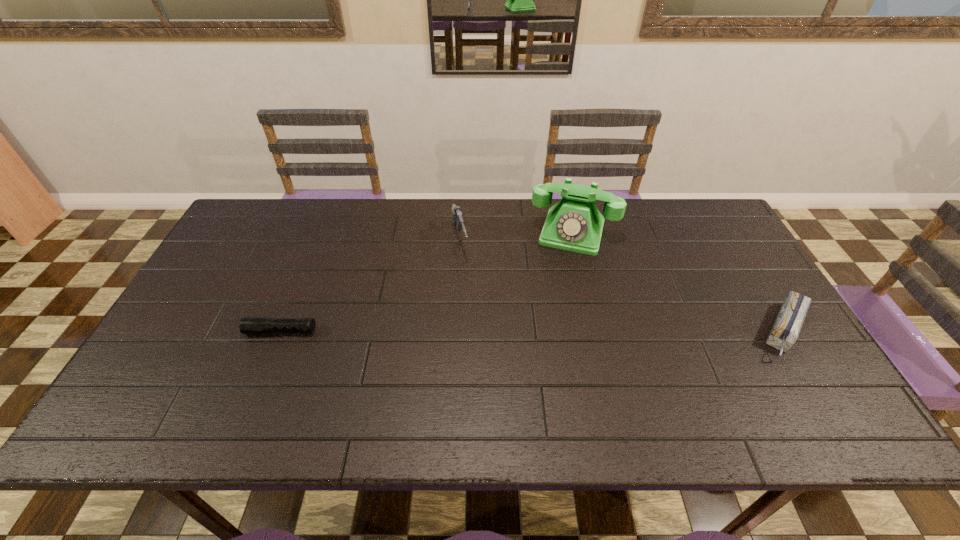
At what (x,y) coordinates should I click in order to perform the action: click on vacant space on the desktop that is between the shortest object and the rightmost object and is positioned at the barrel of the second object from left to right. Please return your answer as a coordinate pair (x, y). Looking at the image, I should click on (488, 331).

Find the location of a particular element. The image size is (960, 540). vacant space on the desktop that is between the flashlight and the pencil box and is positioned on the dial of the tallest object is located at coordinates (546, 331).